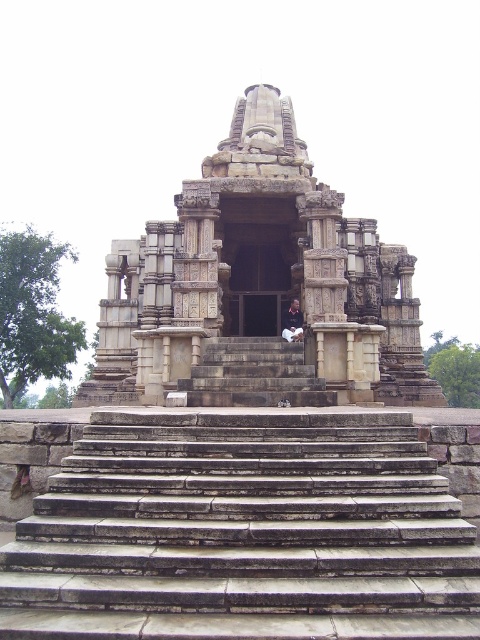
Who is lower down, brown stone stairs at center or stone stairs at center?

Positioned lower is brown stone stairs at center.

Is point (242, 483) closer to viewer compared to point (253, 365)?

Yes.

What are the coordinates of `brown stone stairs at center` in the screenshot? It's located at (243, 532).

Is beige stone hindu temple at center taller than stone stairs at center?

Correct, beige stone hindu temple at center is much taller as stone stairs at center.

Locate an element on the screen. This screenshot has width=480, height=640. beige stone hindu temple at center is located at coordinates (257, 284).

Find the location of `beige stone hindu temple at center`. beige stone hindu temple at center is located at coordinates (257, 284).

This screenshot has width=480, height=640. Identify the location of beige stone hindu temple at center. (257, 284).

Which of these two, brown stone stairs at center or beige stone hindu temple at center, stands shorter?

brown stone stairs at center

Can you confirm if brown stone stairs at center is positioned below beige stone hindu temple at center?

Yes.

Between point (108, 548) and point (204, 179), which one is positioned in front?

Point (108, 548) is more forward.

What are the coordinates of `brown stone stairs at center` in the screenshot? It's located at (243, 532).